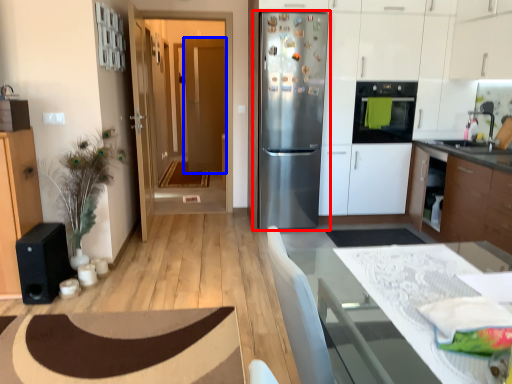
Question: Which object appears farthest to the camera in this image, refrigerator (highlighted by a red box) or door (highlighted by a blue box)?

Choices:
 (A) refrigerator
 (B) door

Answer: (B)